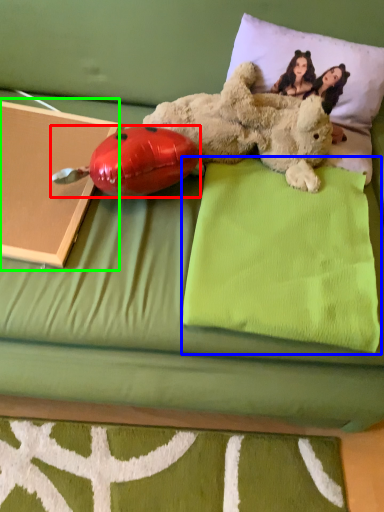
Question: Considering the real-world distances, which object is farthest from ladybug (highlighted by a red box)? pillow (highlighted by a blue box) or paperback book (highlighted by a green box)?

Choices:
 (A) pillow
 (B) paperback book

Answer: (A)